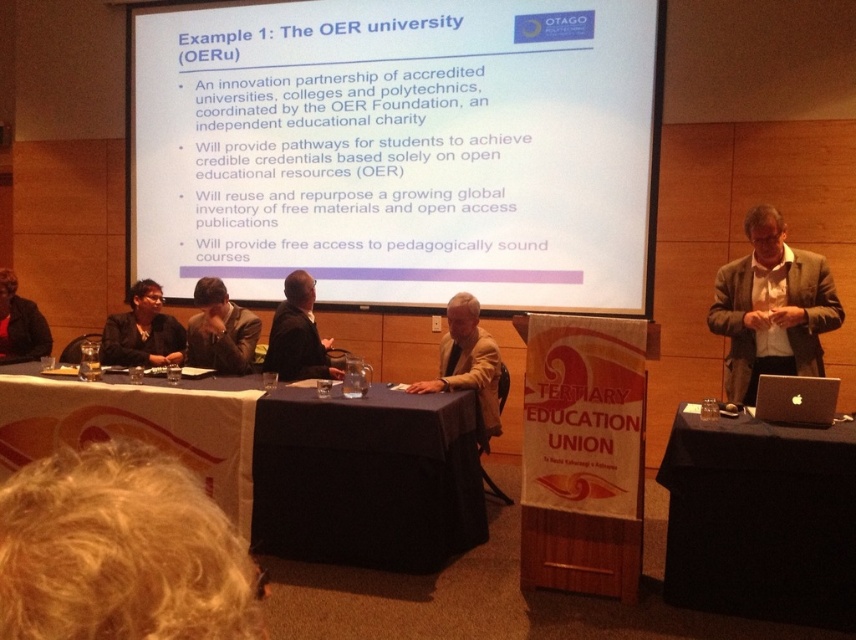
Question: Can you confirm if blonde hair at lower left is positioned to the left of light beige suit at center?

Choices:
 (A) no
 (B) yes

Answer: (B)

Question: Is white matte projector screen at upper center below blue fabric table at center?

Choices:
 (A) no
 (B) yes

Answer: (A)

Question: Which point is farther from the camera taking this photo?

Choices:
 (A) (3, 310)
 (B) (455, 376)

Answer: (A)

Question: Which object is positioned farthest from the black fabric jacket at left?

Choices:
 (A) dark suit jacket at center
 (B) black fabric laptop at right
 (C) blonde hair at lower left
 (D) light beige suit at center

Answer: (C)

Question: Can you confirm if black fabric laptop at right is positioned to the left of dark suit jacket at center?

Choices:
 (A) no
 (B) yes

Answer: (A)

Question: Which of these objects is positioned farthest from the silver metallic laptop at right?

Choices:
 (A) dark brown leather jacket at center
 (B) blonde hair at lower left
 (C) black fabric laptop at right

Answer: (A)